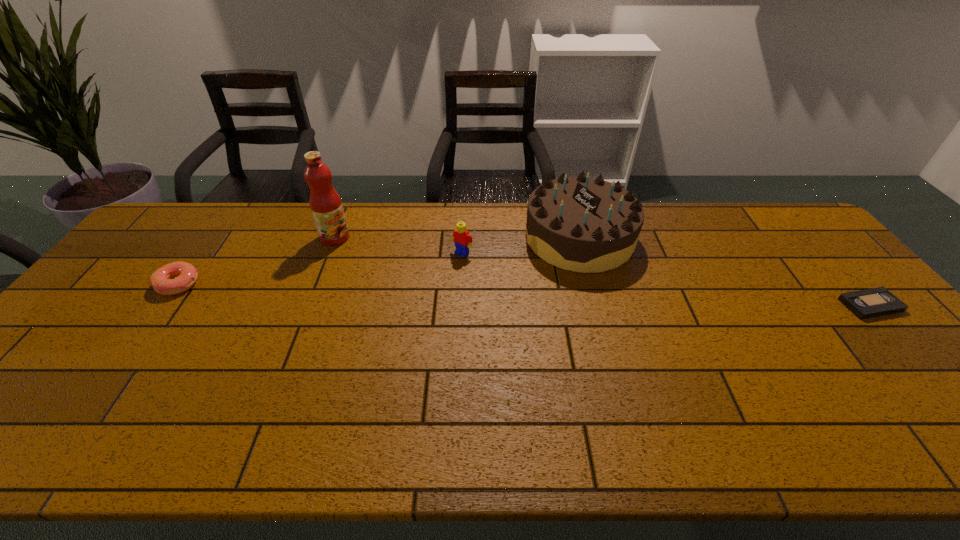
Locate an element on the screen. The image size is (960, 540). empty space that is in between the third object from right to left and the tallest object is located at coordinates (398, 245).

You are a GUI agent. You are given a task and a screenshot of the screen. Output one action in this format:
    pyautogui.click(x=<x>, y=<y>)
    Task: Click on the vacant space in between the third object from left to right and the tallest object
    This screenshot has width=960, height=540.
    Given the screenshot: What is the action you would take?
    pyautogui.click(x=398, y=245)

Identify the location of vacant area between the fourth object from left to right and the third shortest object. (520, 245).

Image resolution: width=960 pixels, height=540 pixels. I want to click on vacant space in between the third shortest object and the tallest object, so pyautogui.click(x=398, y=245).

Where is `unoccupied position between the rightmost object and the fourth object from left to right`? unoccupied position between the rightmost object and the fourth object from left to right is located at coordinates (725, 272).

Locate an element on the screen. vacant space that's between the second object from left to right and the third tallest object is located at coordinates (398, 245).

Image resolution: width=960 pixels, height=540 pixels. What are the coordinates of `vacant point located between the second shortest object and the third object from left to right` in the screenshot? It's located at (321, 268).

Where is `unoccupied area between the Lego and the second shortest object`? unoccupied area between the Lego and the second shortest object is located at coordinates (321, 268).

Identify the location of vacant point located between the fourth tallest object and the Lego. Image resolution: width=960 pixels, height=540 pixels. point(321,268).

At what (x,y) coordinates should I click in order to perform the action: click on the closest object to the second tallest object. Please return your answer as a coordinate pair (x, y). The width and height of the screenshot is (960, 540). Looking at the image, I should click on (462, 239).